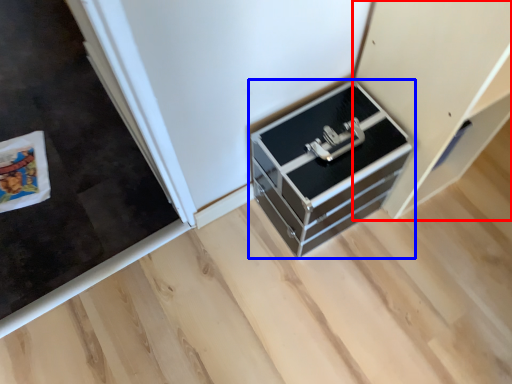
Question: Which object is closer to the camera taking this photo, cabinetry (highlighted by a red box) or chest of drawers (highlighted by a blue box)?

Choices:
 (A) cabinetry
 (B) chest of drawers

Answer: (A)